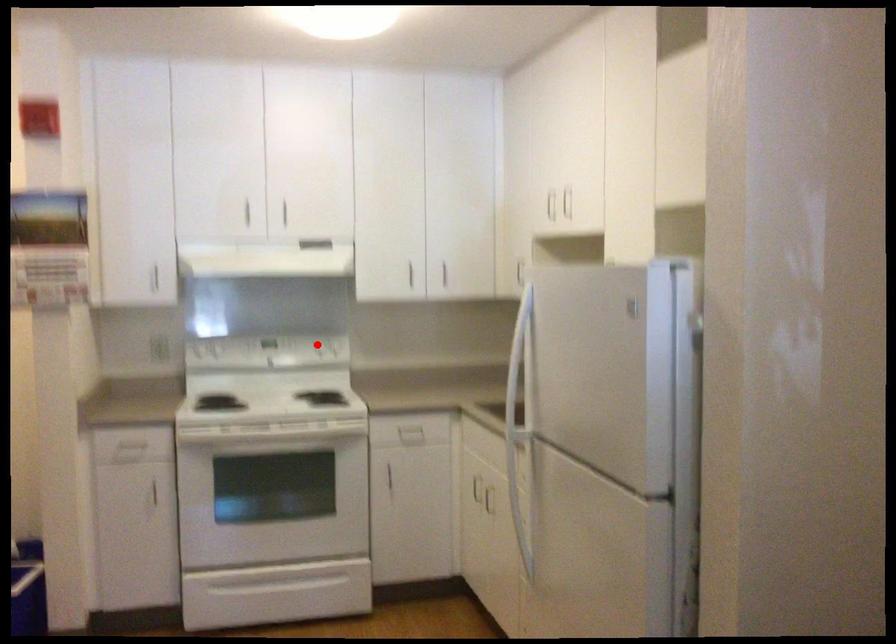
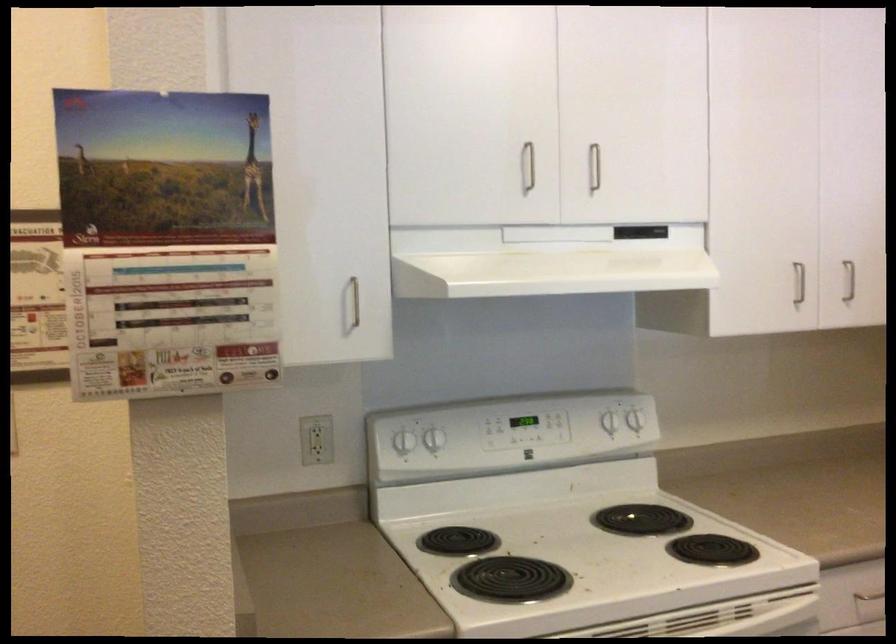
Locate, in the second image, the point that corresponds to the highlighted location in the first image.

(608, 422)